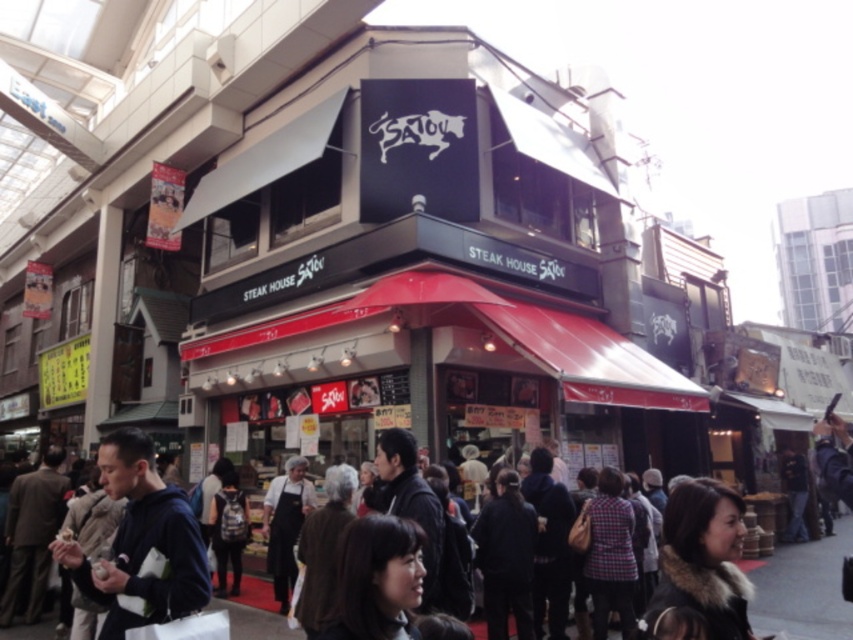
You are standing at the entrance of Satou Steak House and want to find the dark blue hoodie at lower left. Where should you look relative to the entrance?

The dark blue hoodie at lower left is located at point (140,544) relative to the entrance, which would be to the lower left direction from the entrance.